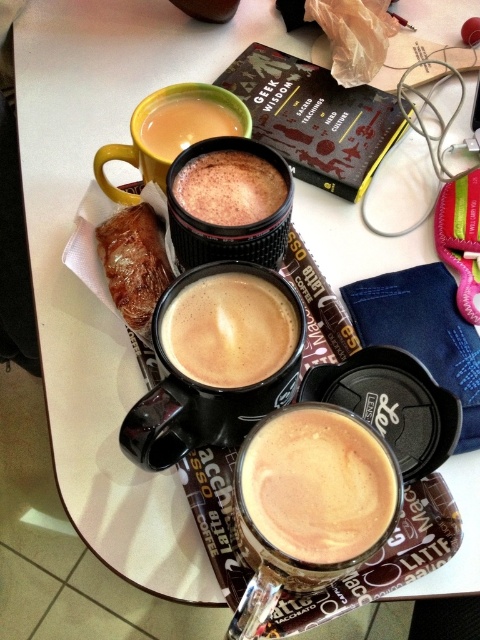
Question: Does cappuccino foam at center appear over brown crumbly pastry at left?

Choices:
 (A) yes
 (B) no

Answer: (B)

Question: Among these objects, which one is farthest from the camera?

Choices:
 (A) yellow matte mug at upper left
 (B) black matte cup at center

Answer: (A)

Question: Which object is farther from the camera taking this photo?

Choices:
 (A) brown crumbly pastry at left
 (B) matte black mug at center
 (C) cappuccino foam at center
 (D) foamy brown coffee at center

Answer: (A)

Question: Estimate the real-world distances between objects in this image. Which object is closer to the brown crumbly pastry at left?

Choices:
 (A) matte yellow cup at upper left
 (B) matte black mug at center
 (C) cappuccino foam at center

Answer: (A)

Question: Is black matte cup at center to the right of matte yellow cup at upper left from the viewer's perspective?

Choices:
 (A) no
 (B) yes

Answer: (B)

Question: Can you confirm if black matte cup at center is positioned to the right of matte black coffee cup at center?

Choices:
 (A) yes
 (B) no

Answer: (B)